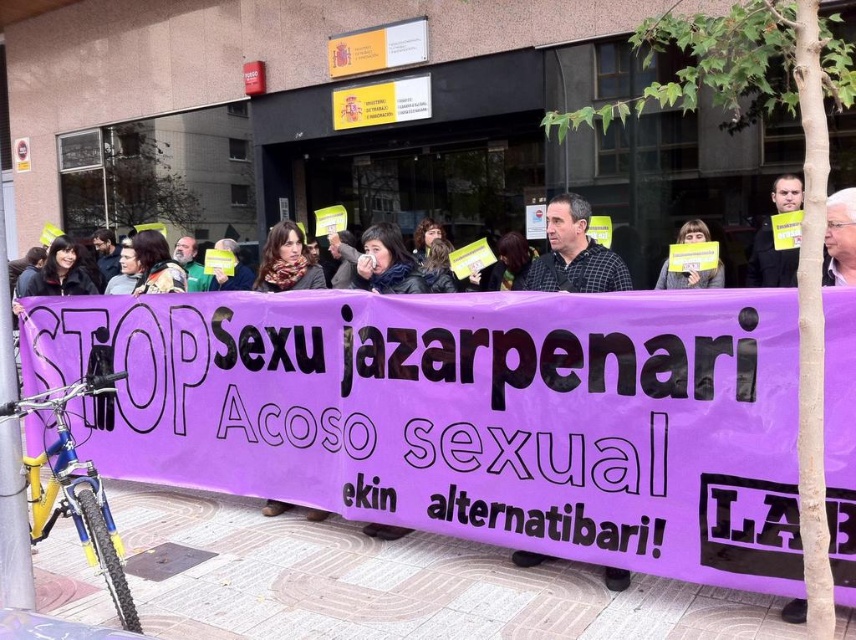
What are the coordinates of the purple scarf at center?

The purple scarf at center is located at point [287,260].

Consider the image. You are a photographer at the protest scene. You want to capture a photo that includes both the checkered fabric shirt at center and the purple fabric at center. Which object should you focus on first to ensure both are in frame?

The checkered fabric shirt at center has a smaller size compared to purple fabric at center. To ensure both are in frame, focus on the larger purple fabric at center first, then adjust to include the smaller checkered fabric shirt at center.